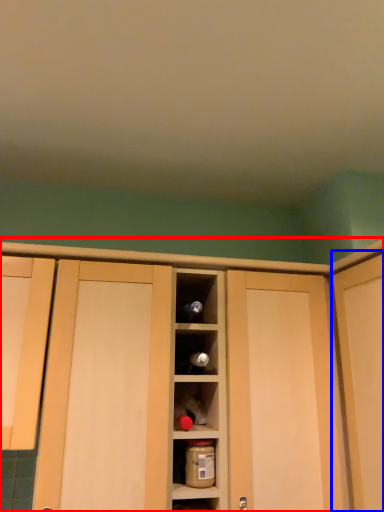
Question: Which object appears closest to the camera in this image, cabinetry (highlighted by a red box) or door (highlighted by a blue box)?

Choices:
 (A) cabinetry
 (B) door

Answer: (B)